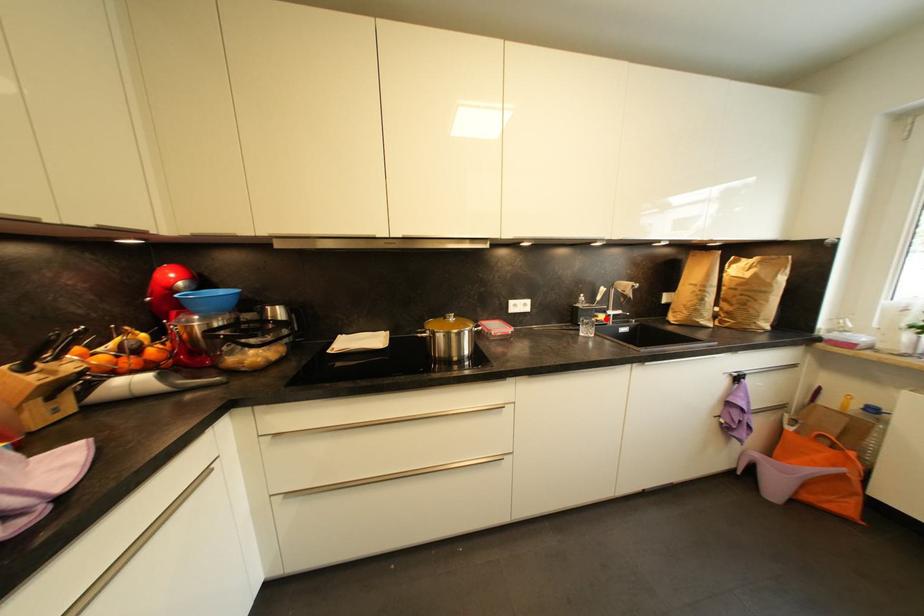
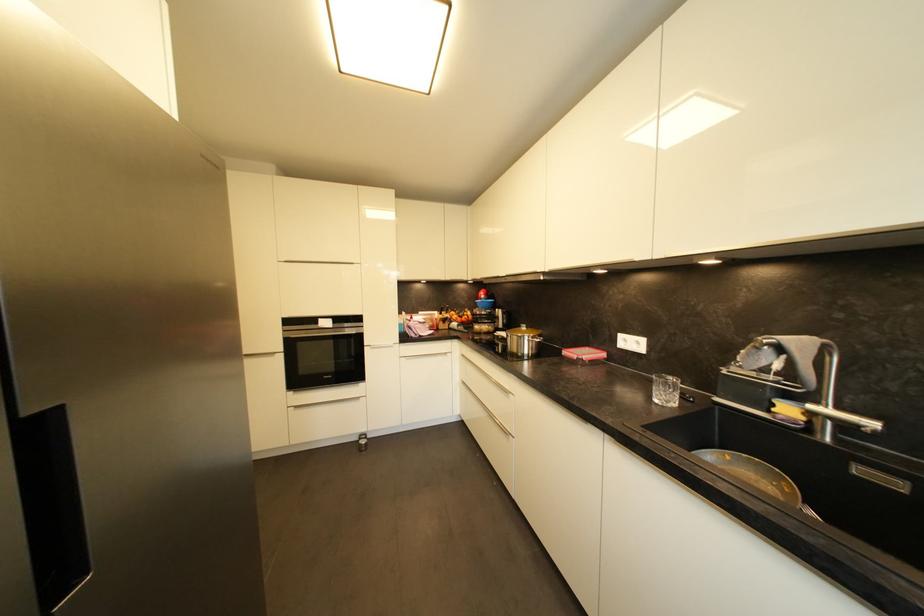
Find the pixel in the second image that matches the highlighted location in the first image.

(793, 411)